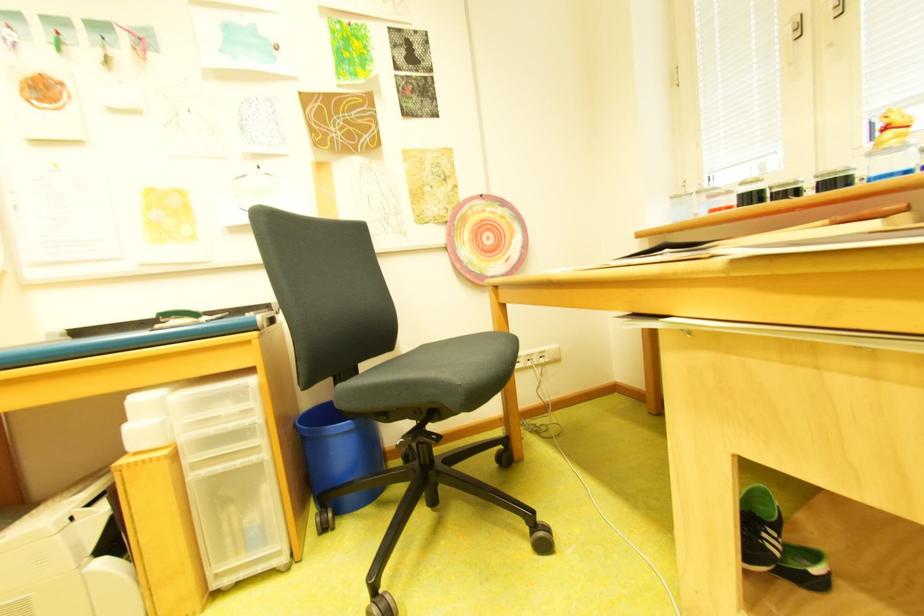
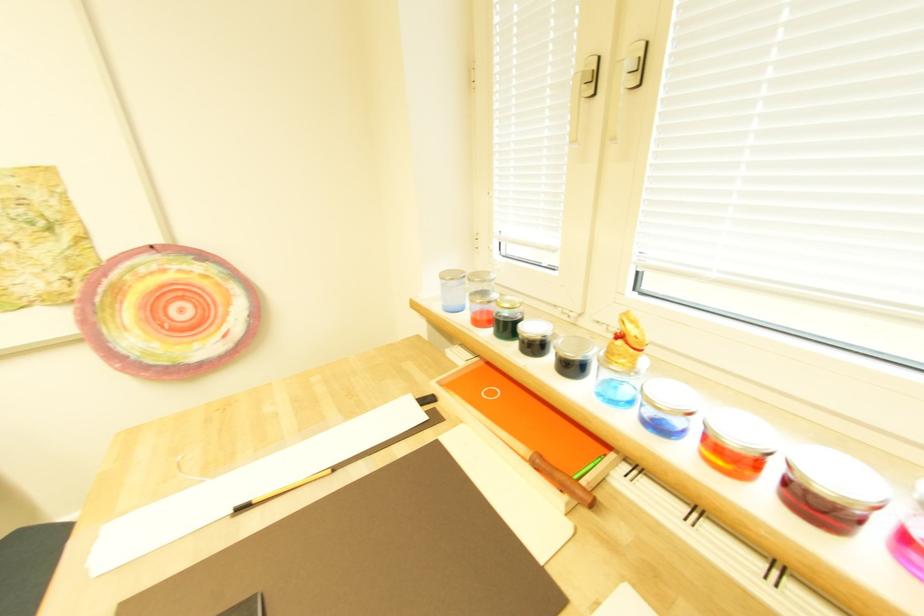
What movement of the cameraman would produce the second image?

The cameraman walked toward right, forward.